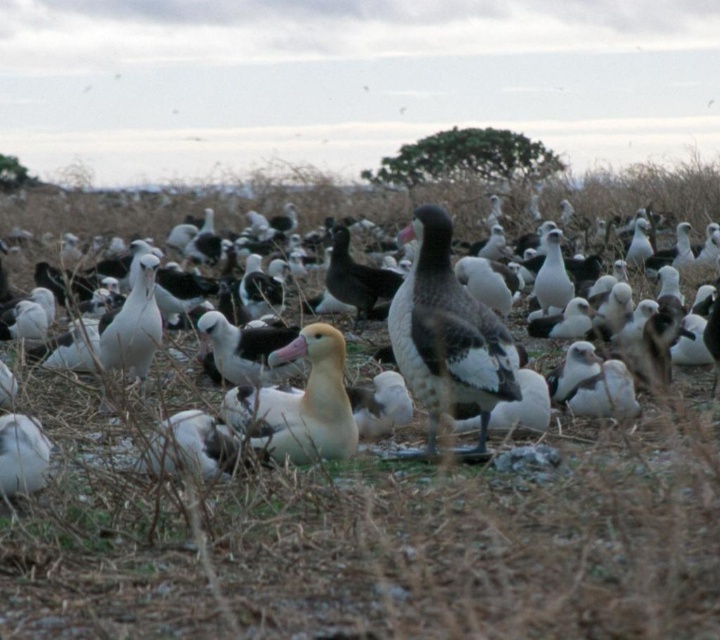
Question: Which of the following is the closest to the observer?

Choices:
 (A) (369, 273)
 (B) (318, 410)

Answer: (B)

Question: Estimate the real-world distances between objects in this image. Which object is farther from the dark brown feathers at center?

Choices:
 (A) white fluffy bird at center
 (B) golden brown feathers at center

Answer: (B)

Question: Where is golden brown feathers at center located in relation to dark brown feathers at center in the image?

Choices:
 (A) below
 (B) above

Answer: (A)

Question: Does white fluffy bird at center appear on the left side of dark brown feathers at center?

Choices:
 (A) yes
 (B) no

Answer: (B)

Question: Among these objects, which one is nearest to the camera?

Choices:
 (A) dark brown feathers at center
 (B) white fluffy bird at center
 (C) golden brown feathers at center

Answer: (B)

Question: Can you confirm if golden brown feathers at center is positioned above dark brown feathers at center?

Choices:
 (A) yes
 (B) no

Answer: (B)